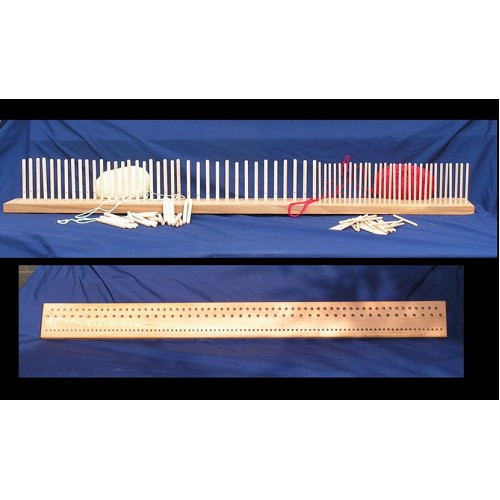
Find the location of a particular element. Image resolution: width=500 pixels, height=500 pixels. yarn on left is located at coordinates (120, 187).